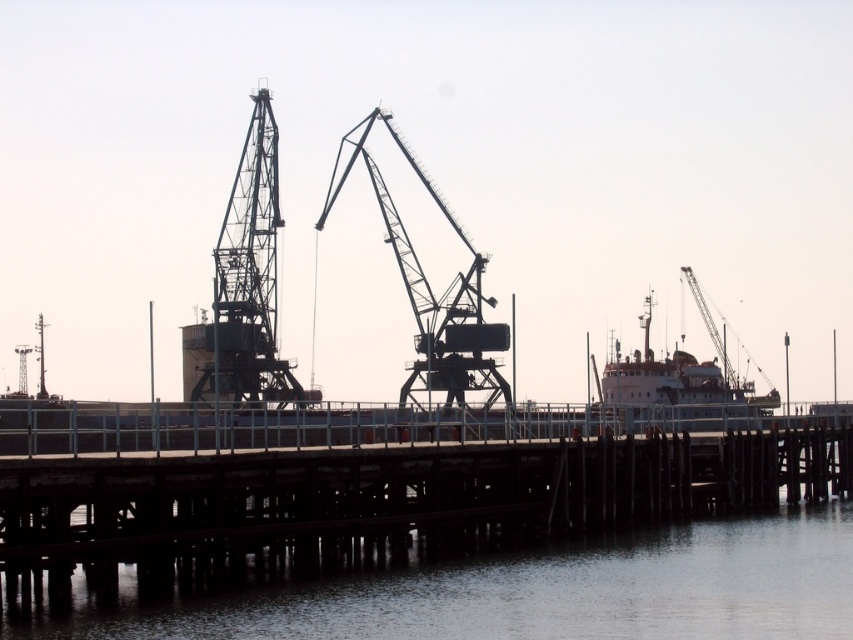
From the picture: You are standing on the brown wooden dock at center and want to jump into the transparent water at lower center. Based on the scene description, is the dock high enough to make the jump feel thrilling?

The brown wooden dock at center is taller than transparent water at lower center, so jumping from the dock into the water would feel thrilling due to the height difference.